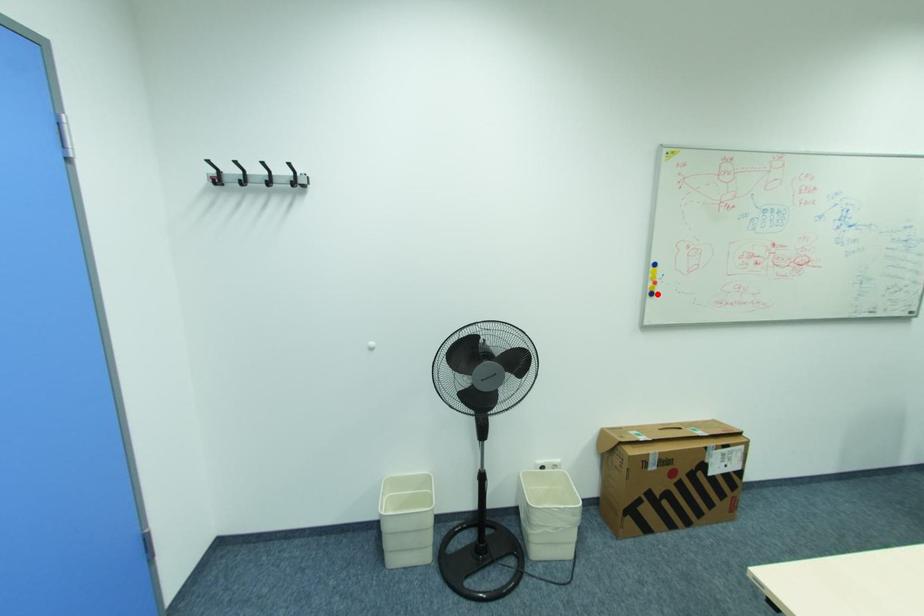
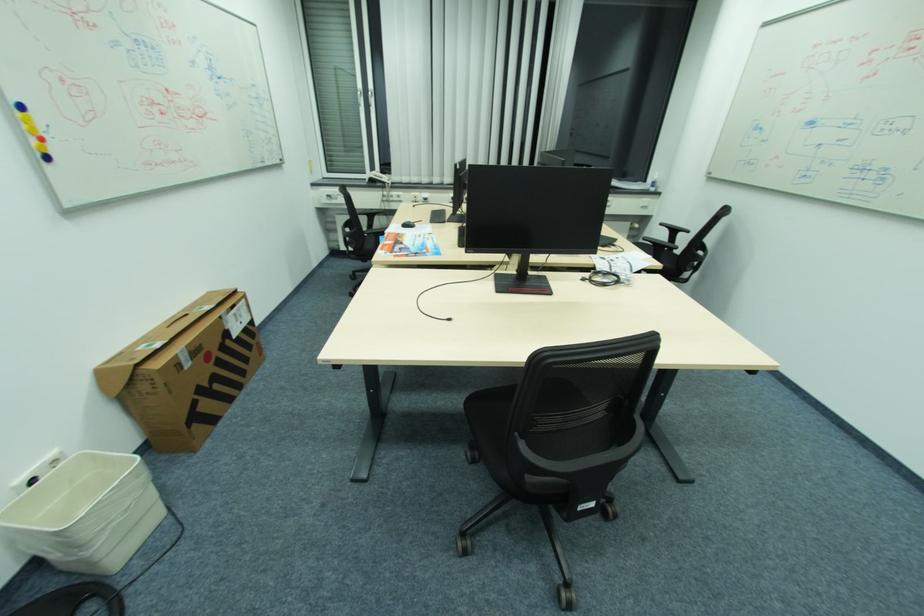
The point at the highlighted location is marked in the first image. Where is the corresponding point in the second image?

(52, 158)